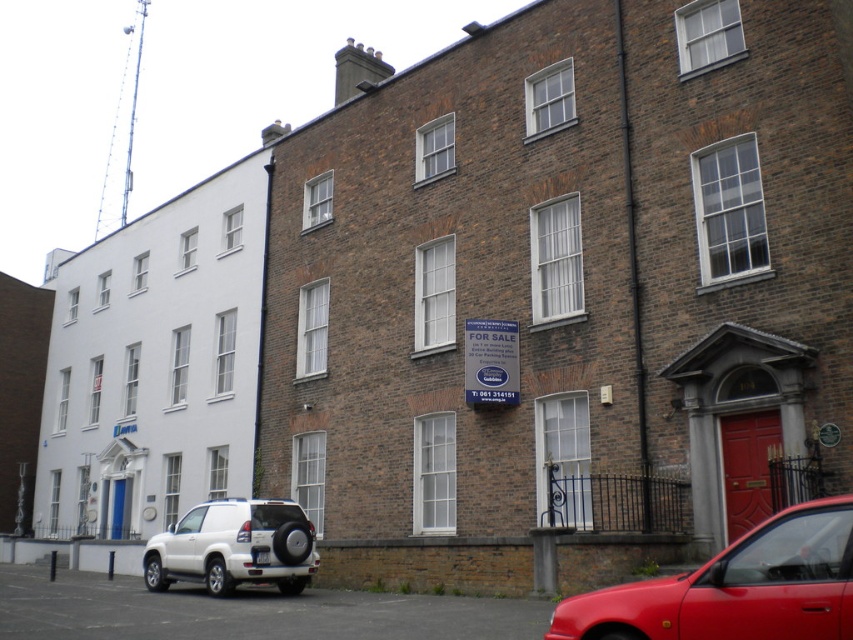
Question: Which point is farther to the camera?

Choices:
 (A) (257, 557)
 (B) (281, 561)
 (C) (846, 557)

Answer: (B)

Question: Which of the following is the farthest from the observer?

Choices:
 (A) (247, 508)
 (B) (262, 554)

Answer: (A)

Question: Among these objects, which one is farthest from the camera?

Choices:
 (A) shiny red car at lower right
 (B) white matte suv at lower left

Answer: (B)

Question: Is white matte suv at lower left thinner than white plastic license plate at center?

Choices:
 (A) no
 (B) yes

Answer: (A)

Question: Can you confirm if shiny red car at lower right is thinner than white plastic license plate at center?

Choices:
 (A) no
 (B) yes

Answer: (A)

Question: Can you confirm if white matte suv at lower left is positioned above white plastic license plate at center?

Choices:
 (A) no
 (B) yes

Answer: (A)